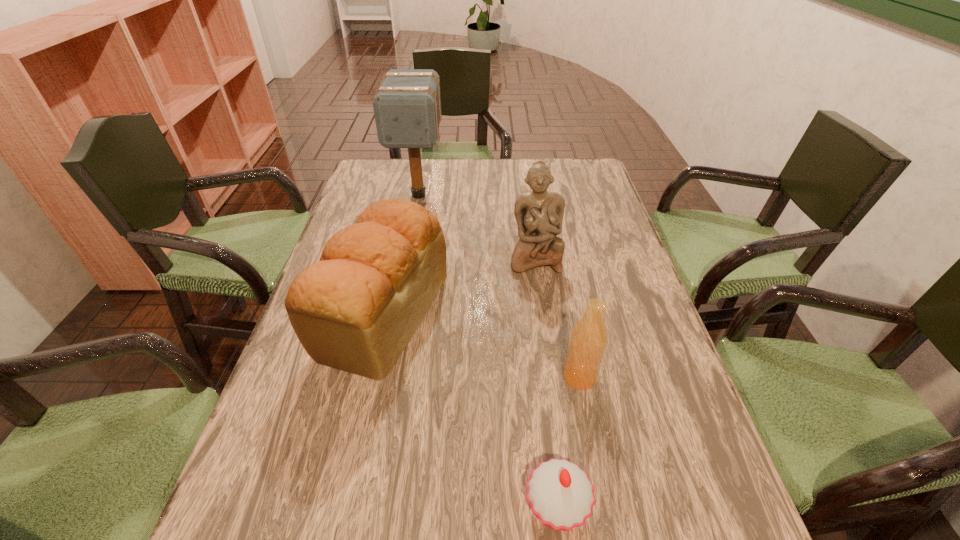
Identify the location of vacant point located between the beer bottle and the mallet. (499, 286).

This screenshot has height=540, width=960. In order to click on unoccupied area between the beer bottle and the bread in this screenshot , I will do `click(481, 345)`.

Image resolution: width=960 pixels, height=540 pixels. I want to click on the second closest object to the figurine, so click(407, 106).

You are a GUI agent. You are given a task and a screenshot of the screen. Output one action in this format:
    pyautogui.click(x=<x>, y=<y>)
    Task: Click on the second closest object to the beer bottle
    This screenshot has width=960, height=540.
    Given the screenshot: What is the action you would take?
    pyautogui.click(x=356, y=309)

Identify the location of vacant region that satisfies the following two spatial constraints: 1. on the front side of the beer bottle; 2. on the left side of the bread. (369, 377).